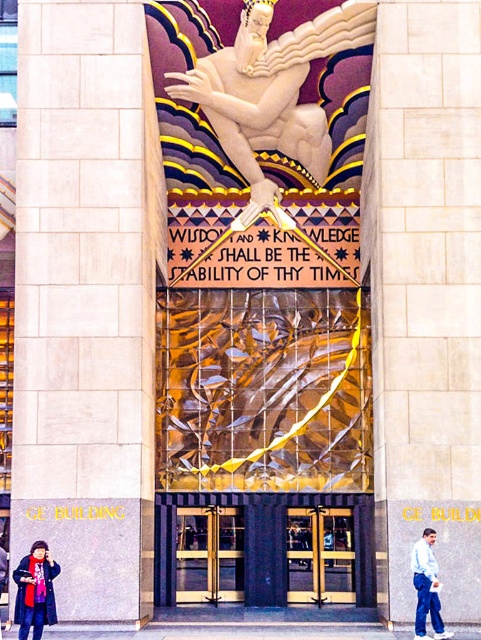
Does beige stone pillar at left lie in front of polished brass doors at center?

Yes, it is in front of polished brass doors at center.

Which is in front, point (65, 618) or point (312, 538)?

Point (65, 618) is more forward.

This screenshot has width=481, height=640. Identify the location of beige stone pillar at left. (87, 301).

Is gold polished metal doors at center positioned behind matte black coat at lower left?

Yes, it is behind matte black coat at lower left.

Which is below, gold polished metal doors at center or matte black coat at lower left?

gold polished metal doors at center is below.

Find the location of a particular element. gold polished metal doors at center is located at coordinates (209, 554).

I want to click on gold polished metal doors at center, so click(x=209, y=554).

Is point (303, 161) closer to camera compared to point (342, 595)?

That is True.

I want to click on white marble statue at upper center, so click(271, 90).